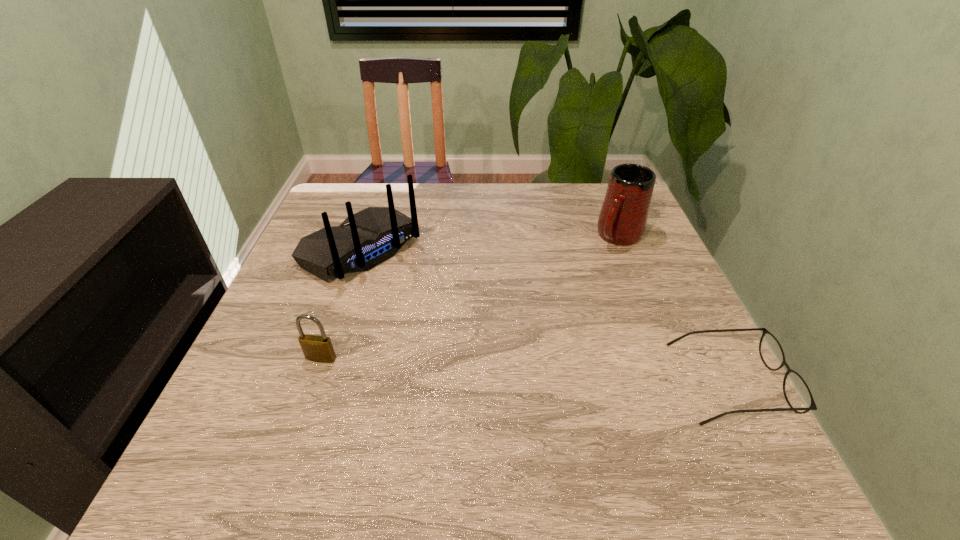
The width and height of the screenshot is (960, 540). I want to click on free space that is in between the router and the third tallest object, so click(x=341, y=304).

The height and width of the screenshot is (540, 960). I want to click on empty space between the third tallest object and the mug, so pyautogui.click(x=470, y=297).

This screenshot has width=960, height=540. What are the coordinates of `vacant space that's between the mug and the third tallest object` in the screenshot? It's located at [x=470, y=297].

The height and width of the screenshot is (540, 960). In order to click on free space that is in between the mug and the second shortest object in this screenshot , I will do `click(470, 297)`.

You are a GUI agent. You are given a task and a screenshot of the screen. Output one action in this format:
    pyautogui.click(x=<x>, y=<y>)
    Task: Click on the vacant area between the mug and the third tallest object
    This screenshot has width=960, height=540.
    Given the screenshot: What is the action you would take?
    pyautogui.click(x=470, y=297)

Where is `free point between the padlock and the mug`? free point between the padlock and the mug is located at coordinates (470, 297).

Locate an element on the screen. The width and height of the screenshot is (960, 540). vacant space in between the spectacles and the padlock is located at coordinates pyautogui.click(x=525, y=370).

Locate an element on the screen. object that is the closest one to the spectacles is located at coordinates (622, 221).

Locate which object ranks third in proximity to the spectacles. Please provide its 2D coordinates. Your answer should be formatted as a tuple, i.e. [(x, y)], where the tuple contains the x and y coordinates of a point satisfying the conditions above.

[(315, 348)]

The width and height of the screenshot is (960, 540). In order to click on vacant point that satisfies the following two spatial constraints: 1. on the front side of the spectacles; 2. on the front-facing side of the padlock in this screenshot , I will do `click(313, 382)`.